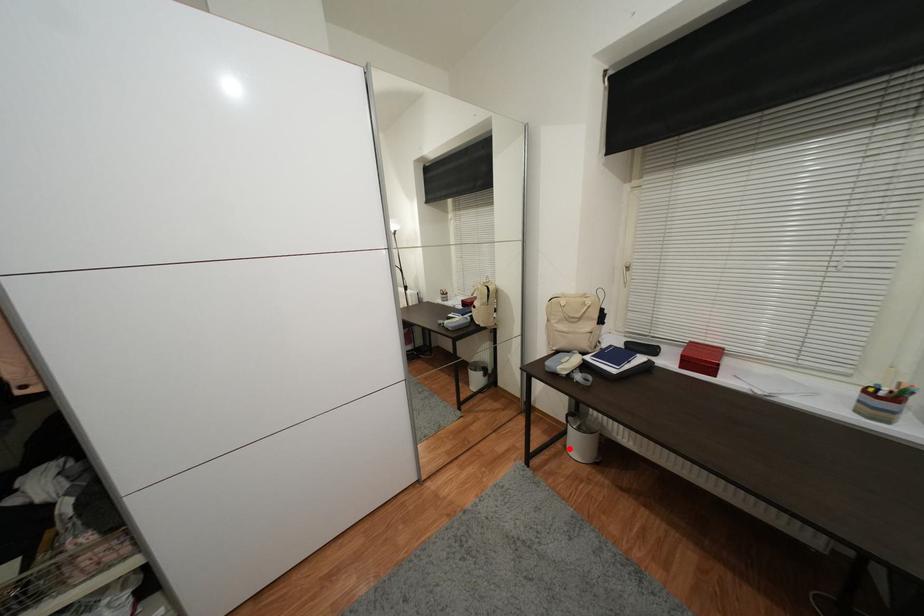
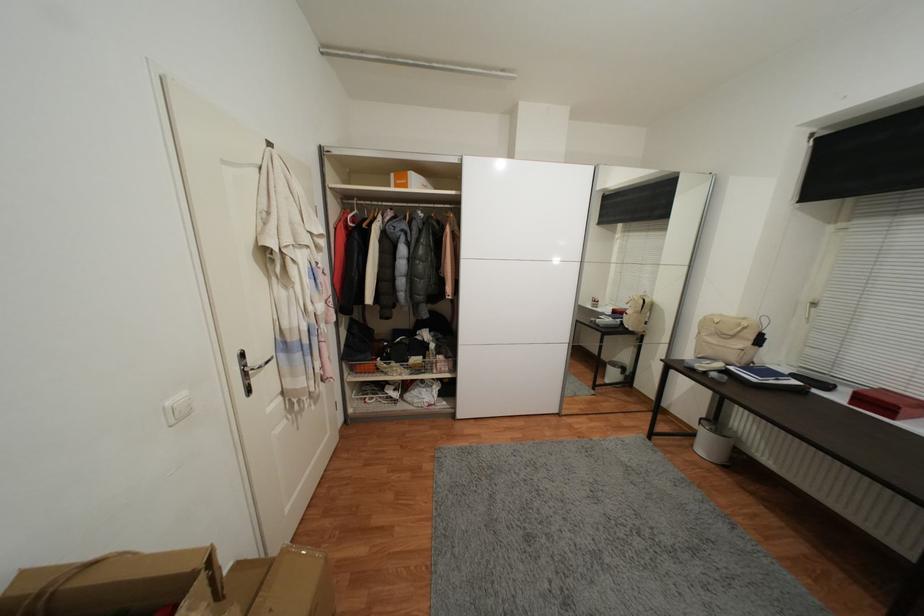
Question: I am providing you with two images of the same scene from different viewpoints. A red point is marked on the first image. Can you still see the location of the red point in image 2?

Choices:
 (A) Yes
 (B) No

Answer: (A)